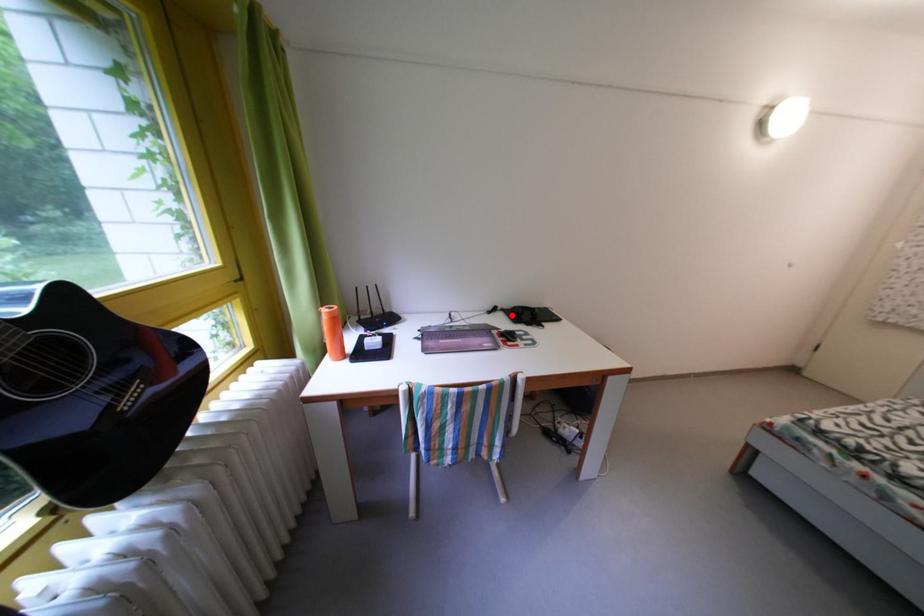
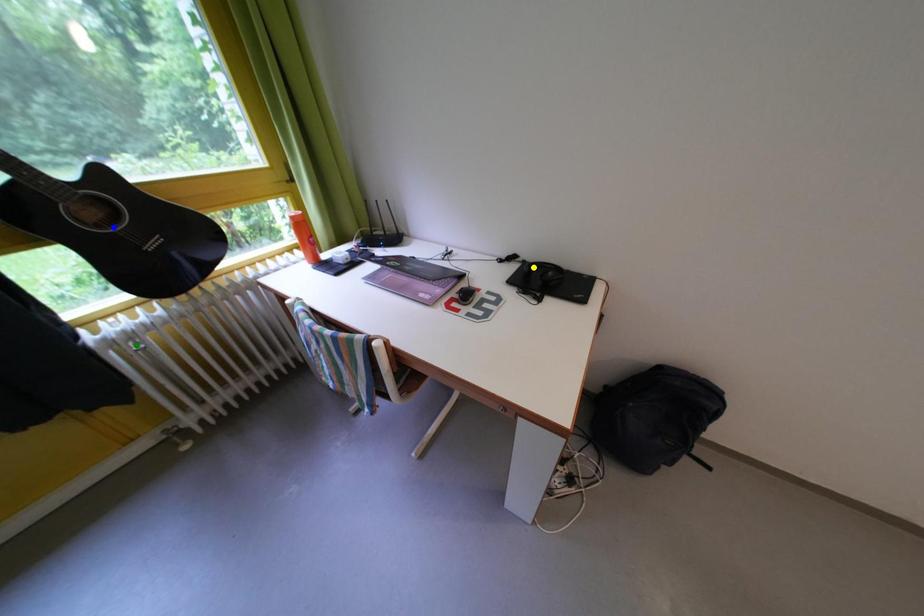
Question: I am providing you with two images of the same scene from different viewpoints. A red point is marked on the first image. You are given multiple points on the second image. Which spot in image 2 lines up with the point in image 1?

Choices:
 (A) blue point
 (B) green point
 (C) yellow point

Answer: (C)